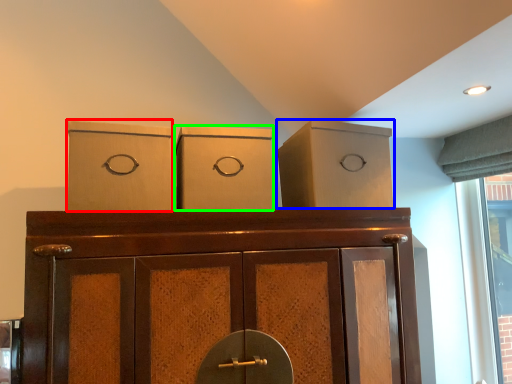
Question: Estimate the real-world distances between objects in this image. Which object is closer to cardboard box (highlighted by a red box), cabinetry (highlighted by a blue box) or cardboard box (highlighted by a green box)?

Choices:
 (A) cabinetry
 (B) cardboard box

Answer: (B)